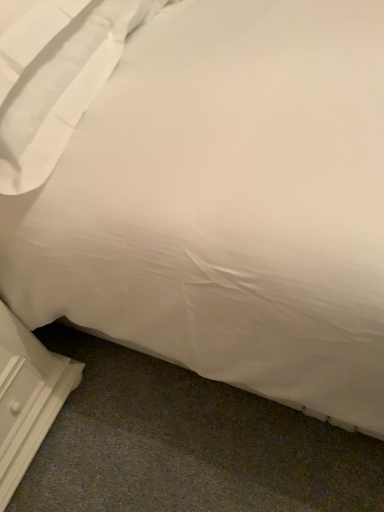
Question: Is white wood dresser at lower left closer to the viewer compared to white smooth pillow at upper left?

Choices:
 (A) no
 (B) yes

Answer: (A)

Question: Does white wood dresser at lower left lie behind white smooth pillow at upper left?

Choices:
 (A) no
 (B) yes

Answer: (B)

Question: Considering the relative sizes of white wood dresser at lower left and white smooth pillow at upper left in the image provided, is white wood dresser at lower left smaller than white smooth pillow at upper left?

Choices:
 (A) no
 (B) yes

Answer: (B)

Question: Could white smooth pillow at upper left be considered to be inside white wood dresser at lower left?

Choices:
 (A) no
 (B) yes

Answer: (A)

Question: Considering the relative sizes of white wood dresser at lower left and white smooth pillow at upper left in the image provided, is white wood dresser at lower left thinner than white smooth pillow at upper left?

Choices:
 (A) no
 (B) yes

Answer: (B)

Question: Does white wood dresser at lower left have a larger size compared to white smooth pillow at upper left?

Choices:
 (A) no
 (B) yes

Answer: (A)

Question: From a real-world perspective, is white smooth pillow at upper left over white wood dresser at lower left?

Choices:
 (A) no
 (B) yes

Answer: (B)

Question: Is white smooth pillow at upper left behind white wood dresser at lower left?

Choices:
 (A) no
 (B) yes

Answer: (A)

Question: From the image's perspective, is white smooth pillow at upper left beneath white wood dresser at lower left?

Choices:
 (A) yes
 (B) no

Answer: (B)

Question: From the image's perspective, is white smooth pillow at upper left on white wood dresser at lower left?

Choices:
 (A) no
 (B) yes

Answer: (B)

Question: Is white smooth pillow at upper left touching white wood dresser at lower left?

Choices:
 (A) no
 (B) yes

Answer: (A)

Question: Considering the relative sizes of white smooth pillow at upper left and white wood dresser at lower left in the image provided, is white smooth pillow at upper left thinner than white wood dresser at lower left?

Choices:
 (A) yes
 (B) no

Answer: (B)

Question: Is white wood dresser at lower left wider or thinner than white smooth pillow at upper left?

Choices:
 (A) thin
 (B) wide

Answer: (A)